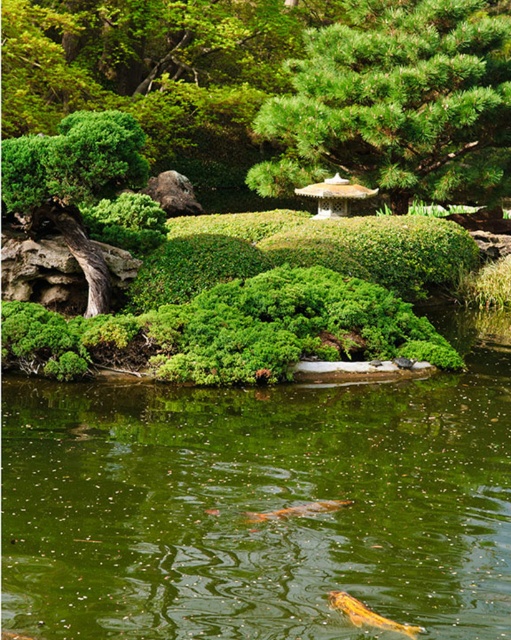
Can you confirm if green leafy bush at left is positioned above shiny orange fish at lower center?

Yes.

Who is positioned more to the left, green leafy bush at left or shiny orange fish at lower center?

From the viewer's perspective, green leafy bush at left appears more on the left side.

At what (x,y) coordinates should I click in order to perform the action: click on green leafy bush at left. Please return your answer as a coordinate pair (x, y). Image resolution: width=511 pixels, height=640 pixels. Looking at the image, I should click on (75, 182).

Does green glossy water at center have a greater height compared to shiny orange fish at lower center?

Yes, green glossy water at center is taller than shiny orange fish at lower center.

Between point (408, 419) and point (355, 604), which one is positioned behind?

The point (408, 419) is behind.

Identify the location of green glossy water at center. This screenshot has width=511, height=640. (261, 502).

Is point (68, 209) behind point (326, 509)?

That is True.

At what (x,y) coordinates should I click in order to perform the action: click on green leafy bush at left. Please return your answer as a coordinate pair (x, y). This screenshot has width=511, height=640. Looking at the image, I should click on (75, 182).

Does point (6, 186) come closer to viewer compared to point (286, 513)?

No.

Where is `green leafy bush at left`? green leafy bush at left is located at coordinates (75, 182).